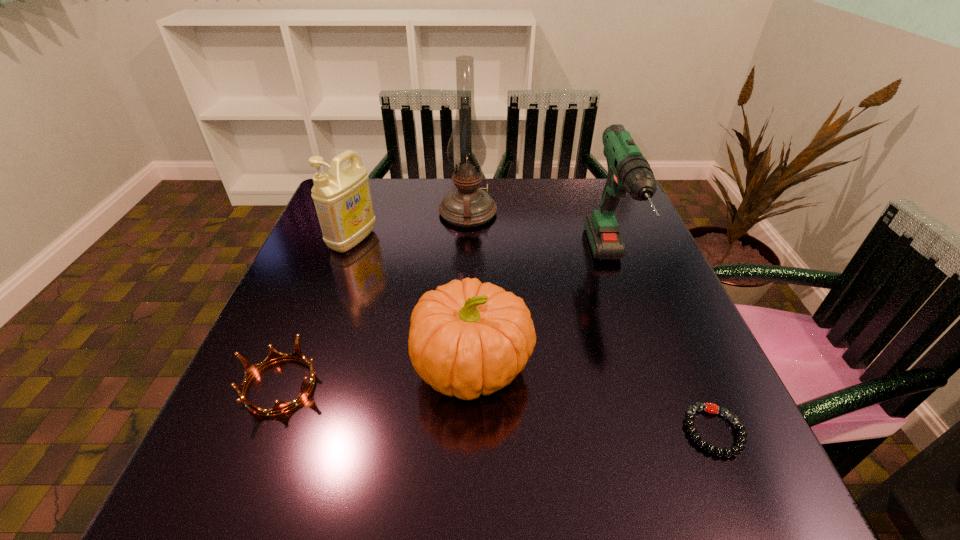
Identify the location of vacant space at the left edge of the desktop. The width and height of the screenshot is (960, 540). (268, 352).

In the image, there is a desktop. Where is `vacant area at the right edge`? This screenshot has height=540, width=960. vacant area at the right edge is located at coordinates (638, 400).

At what (x,y) coordinates should I click in order to perform the action: click on vacant area at the far left corner. Please return your answer as a coordinate pair (x, y). The height and width of the screenshot is (540, 960). Looking at the image, I should click on (393, 181).

Where is `free space at the near left corner of the desktop`? The height and width of the screenshot is (540, 960). free space at the near left corner of the desktop is located at coordinates (281, 494).

This screenshot has height=540, width=960. In the image, there is a desktop. Identify the location of vacant space at the far right corner. (634, 215).

This screenshot has width=960, height=540. I want to click on vacant area that lies between the pumpkin and the shortest object, so click(x=593, y=399).

Where is `vacant point located between the drill and the shortest object`? vacant point located between the drill and the shortest object is located at coordinates (662, 349).

Image resolution: width=960 pixels, height=540 pixels. Find the location of `vacant area between the third tallest object and the drill`. vacant area between the third tallest object and the drill is located at coordinates (481, 253).

Locate an element on the screen. The image size is (960, 540). free spot between the pumpkin and the drill is located at coordinates (541, 316).

Locate an element on the screen. vacant area between the shortest object and the tallest object is located at coordinates [591, 322].